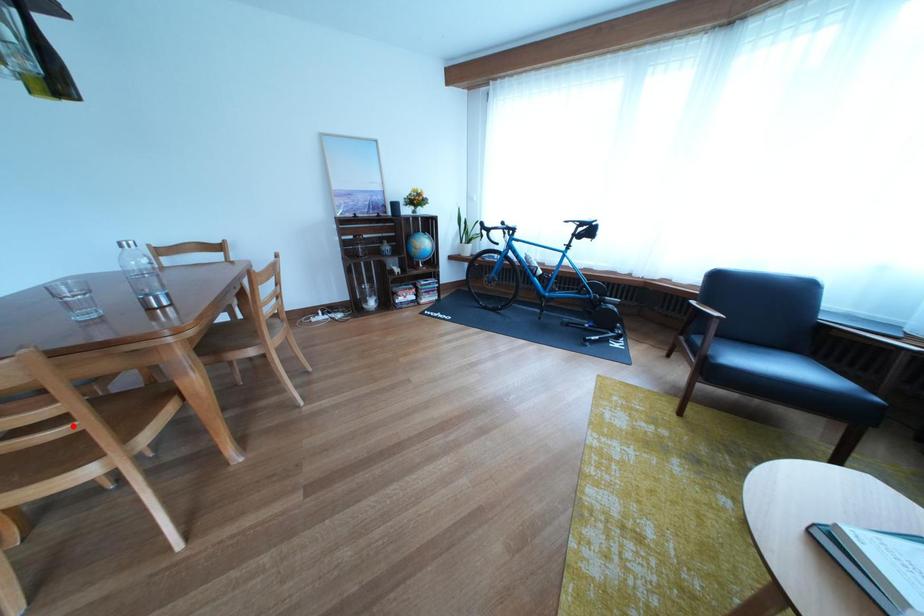
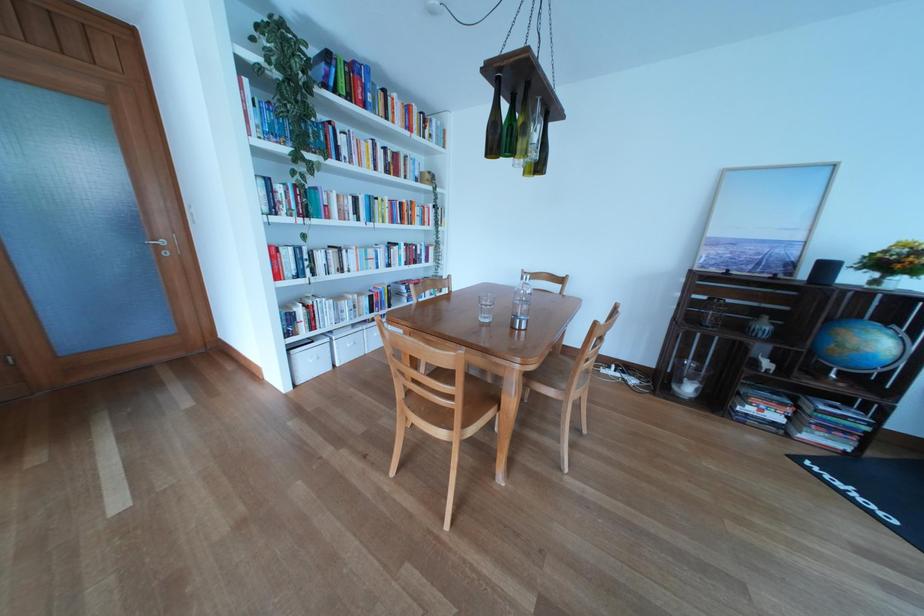
Question: A red point is marked in image1. In image2, is the corresponding 3D point closer to the camera or farther? Reply with the corresponding letter.

Choices:
 (A) The corresponding 3D point is closer.
 (B) The corresponding 3D point is farther.

Answer: (B)